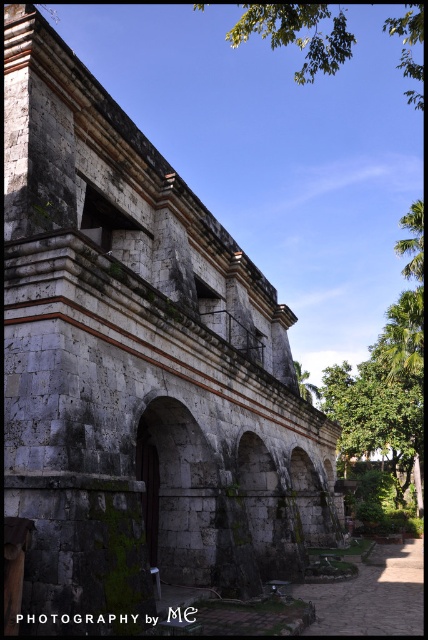
You are an architect assessing the historic building. You notice two green leafy trees in the image. Which tree has a wider spread, the green leafy tree at right or the green leafy tree at upper right?

The green leafy tree at right has a wider spread than the green leafy tree at upper right.